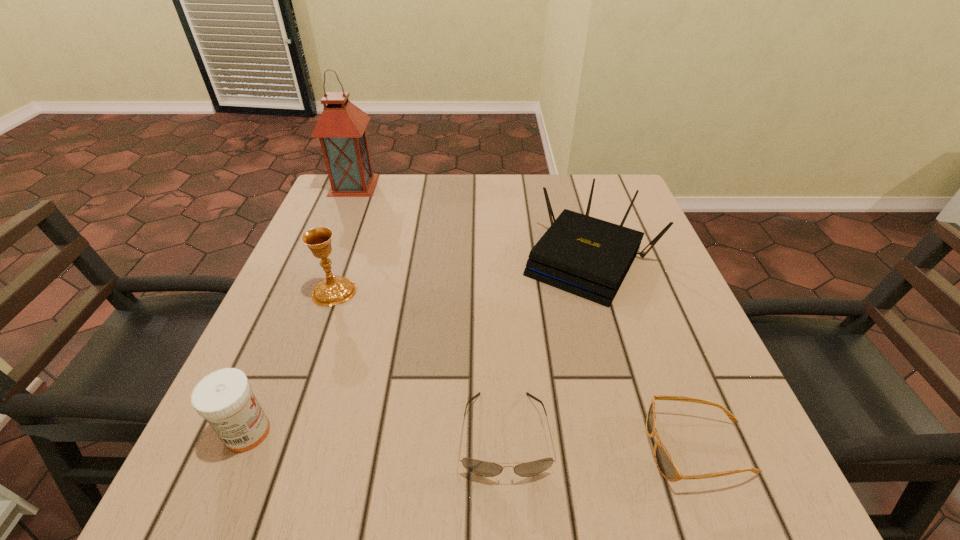
Find the location of a particular element. This screenshot has width=960, height=540. router at the right edge is located at coordinates (585, 256).

At what (x,y) coordinates should I click in order to perform the action: click on sunglasses positioned at the right edge. Please return your answer as a coordinate pair (x, y). Looking at the image, I should click on pos(664,462).

The height and width of the screenshot is (540, 960). Identify the location of object that is at the far left corner. (341, 127).

Find the location of a particular element. The width and height of the screenshot is (960, 540). object that is at the near left corner is located at coordinates (224, 398).

This screenshot has width=960, height=540. I want to click on object located at the far right corner, so click(x=585, y=256).

The width and height of the screenshot is (960, 540). Identify the location of object present at the near right corner. (664, 462).

The height and width of the screenshot is (540, 960). In the image, there is a desktop. Identify the location of vacant space at the far edge. tap(504, 221).

You are a GUI agent. You are given a task and a screenshot of the screen. Output one action in this format:
    pyautogui.click(x=<x>, y=<y>)
    Task: Click on the free space at the left edge
    This screenshot has width=960, height=540.
    Given the screenshot: What is the action you would take?
    pyautogui.click(x=354, y=299)

Where is `vacant space at the right edge`? vacant space at the right edge is located at coordinates (688, 364).

This screenshot has height=540, width=960. I want to click on free space at the far left corner, so click(369, 214).